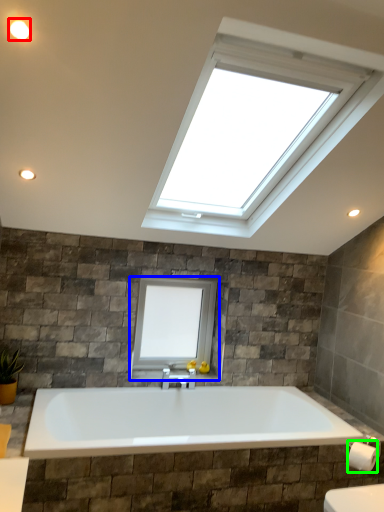
Question: Which is farther away from lighting (highlighted by a red box)? window (highlighted by a blue box) or toilet paper (highlighted by a green box)?

Choices:
 (A) window
 (B) toilet paper

Answer: (B)